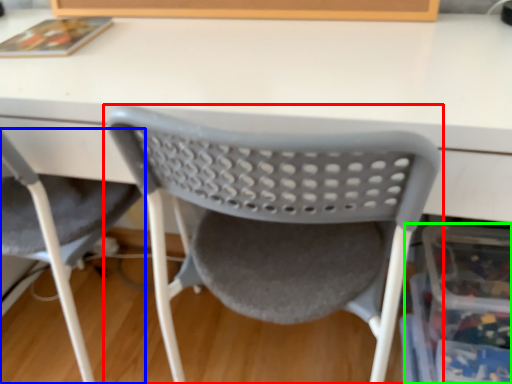
Question: Estimate the real-world distances between objects in this image. Which object is closer to chair (highlighted by a red box), chair (highlighted by a blue box) or storage box (highlighted by a green box)?

Choices:
 (A) chair
 (B) storage box

Answer: (B)